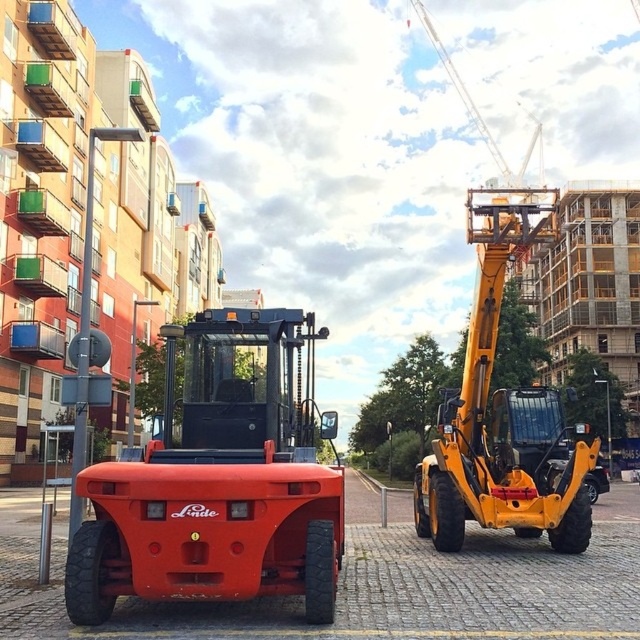
You are a construction worker planning to place a 2.5 meter tall storage container between the matte orange tractor at center and the yellow metallic excavator at right. Based on their heights, can the container be placed without obstructing either machine?

The matte orange tractor at center is shorter than the yellow metallic excavator at right. Since the container is 2.5 meters tall, it can be placed between them as long as it doesn not exceed the height of the shorter matte orange tractor at center. However, since the tractor is already shorter, the container might block the excavator if placed too close. The exact placement depends on the tractor height, but given the description, the container can be positioned between them without obstructing the tractor

You are standing at the entrance of the construction site and need to locate the matte orange tractor at center. According to the coordinates provided, where exactly is it positioned?

The matte orange tractor at center is located at the 2D coordinates point [218,483].